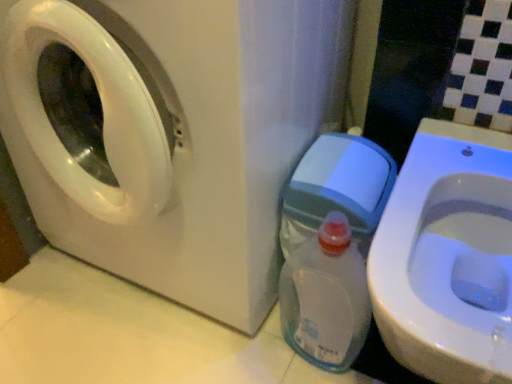
Question: Can you confirm if clear plastic bottle at lower right is bigger than white glossy toilet at lower right?

Choices:
 (A) yes
 (B) no

Answer: (B)

Question: From the image's perspective, is clear plastic bottle at lower right below white glossy toilet at lower right?

Choices:
 (A) no
 (B) yes

Answer: (B)

Question: Would you say clear plastic bottle at lower right is outside white glossy toilet at lower right?

Choices:
 (A) yes
 (B) no

Answer: (A)

Question: Is clear plastic bottle at lower right closer to the viewer compared to white glossy toilet at lower right?

Choices:
 (A) no
 (B) yes

Answer: (A)

Question: From a real-world perspective, is clear plastic bottle at lower right under white glossy toilet at lower right?

Choices:
 (A) yes
 (B) no

Answer: (A)

Question: Does clear plastic bottle at lower right turn towards white glossy toilet at lower right?

Choices:
 (A) no
 (B) yes

Answer: (A)

Question: Considering the relative positions of white glossy washing machine at left and white glossy toilet at lower right in the image provided, is white glossy washing machine at left behind white glossy toilet at lower right?

Choices:
 (A) no
 (B) yes

Answer: (B)

Question: Considering the relative sizes of white glossy washing machine at left and white glossy toilet at lower right in the image provided, is white glossy washing machine at left shorter than white glossy toilet at lower right?

Choices:
 (A) yes
 (B) no

Answer: (B)

Question: Does white glossy washing machine at left have a lesser width compared to white glossy toilet at lower right?

Choices:
 (A) no
 (B) yes

Answer: (A)

Question: Is white glossy washing machine at left to the left of white glossy toilet at lower right from the viewer's perspective?

Choices:
 (A) no
 (B) yes

Answer: (B)

Question: Is white glossy washing machine at left positioned far away from white glossy toilet at lower right?

Choices:
 (A) yes
 (B) no

Answer: (B)

Question: From a real-world perspective, is white glossy washing machine at left positioned under white glossy toilet at lower right based on gravity?

Choices:
 (A) no
 (B) yes

Answer: (A)

Question: From a real-world perspective, is white glossy toilet at lower right on clear plastic bottle at lower right?

Choices:
 (A) yes
 (B) no

Answer: (A)